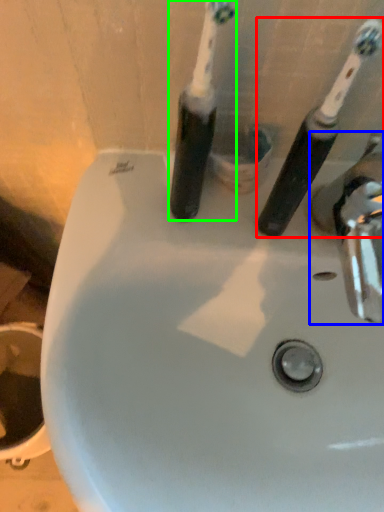
Question: Based on their relative distances, which object is nearer to toothbrush (highlighted by a red box)? Choose from tap (highlighted by a blue box) and toothbrush (highlighted by a green box).

Choices:
 (A) tap
 (B) toothbrush

Answer: (A)